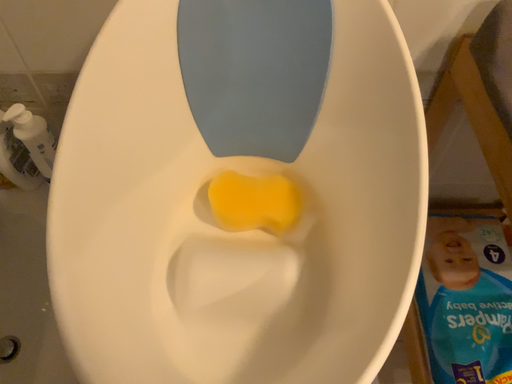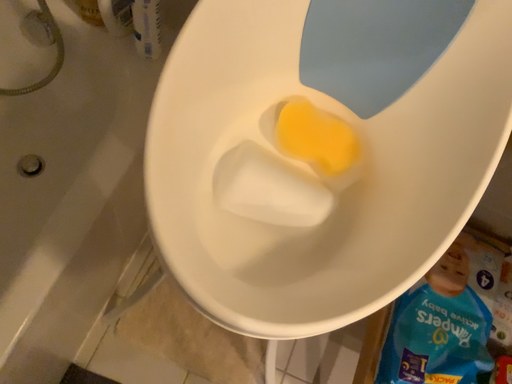
Question: How did the camera likely rotate when shooting the video?

Choices:
 (A) rotated downward
 (B) rotated upward

Answer: (A)